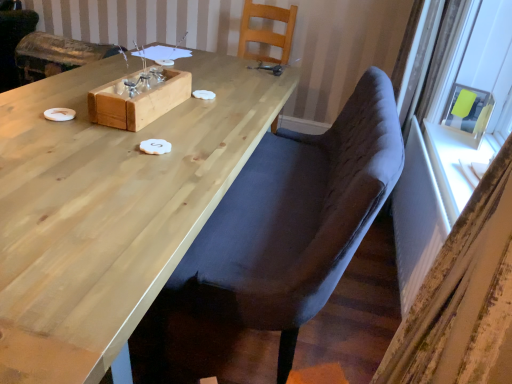
Question: Should I look upward or downward to see satin gray curtain at right?

Choices:
 (A) down
 (B) up

Answer: (A)

Question: Is wooden box at center far from wooden armchair at upper left?

Choices:
 (A) no
 (B) yes

Answer: (B)

Question: Are wooden box at center and wooden armchair at upper left beside each other?

Choices:
 (A) yes
 (B) no

Answer: (B)

Question: From a real-world perspective, is wooden box at center on top of wooden armchair at upper left?

Choices:
 (A) no
 (B) yes

Answer: (B)

Question: Is wooden box at center positioned with its back to wooden armchair at upper left?

Choices:
 (A) yes
 (B) no

Answer: (B)

Question: From a real-world perspective, is wooden box at center positioned under wooden armchair at upper left based on gravity?

Choices:
 (A) no
 (B) yes

Answer: (A)

Question: Is wooden box at center smaller than wooden armchair at upper left?

Choices:
 (A) yes
 (B) no

Answer: (A)

Question: From the image's perspective, would you say natural wood table at center is shown under wooden armchair at upper left?

Choices:
 (A) no
 (B) yes

Answer: (B)

Question: Does natural wood table at center have a larger size compared to wooden armchair at upper left?

Choices:
 (A) no
 (B) yes

Answer: (B)

Question: Is natural wood table at center located outside wooden armchair at upper left?

Choices:
 (A) no
 (B) yes

Answer: (B)

Question: Would you say natural wood table at center is a long distance from wooden armchair at upper left?

Choices:
 (A) yes
 (B) no

Answer: (A)

Question: Is the position of natural wood table at center more distant than that of wooden armchair at upper left?

Choices:
 (A) no
 (B) yes

Answer: (A)

Question: Is natural wood table at center facing towards wooden armchair at upper left?

Choices:
 (A) yes
 (B) no

Answer: (A)

Question: Is wooden box at center touching natural wood table at center?

Choices:
 (A) yes
 (B) no

Answer: (B)